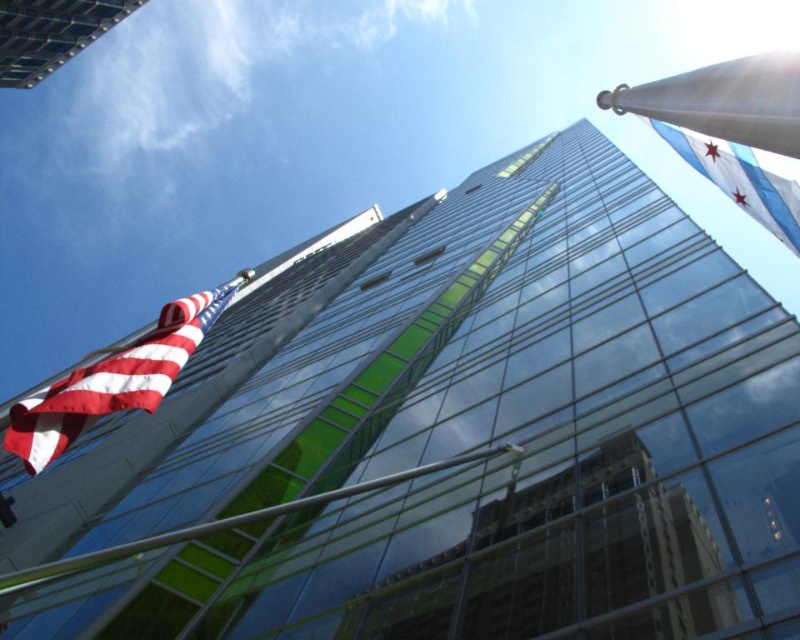
You are standing directly below the white metallic flagpole at upper right. Which direction should you look to see the flagpole?

Since the white metallic flagpole at upper right is positioned at point [724,100], you should look upward and to the right to see it.